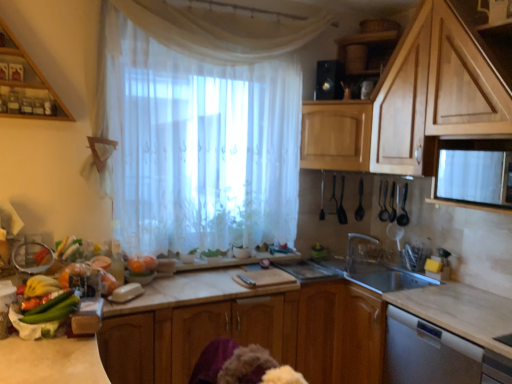
Question: Can you confirm if green matte cucumber at lower left is smaller than black plastic spoon at right, the fifth appliance viewed from the left?

Choices:
 (A) no
 (B) yes

Answer: (B)

Question: Considering the relative positions of green matte cucumber at lower left and black plastic spoon at right, placed as the third appliance when sorted from right to left, in the image provided, is green matte cucumber at lower left to the right of black plastic spoon at right, placed as the third appliance when sorted from right to left, from the viewer's perspective?

Choices:
 (A) no
 (B) yes

Answer: (A)

Question: Is green matte cucumber at lower left far from black plastic spoon at right, placed as the third appliance when sorted from right to left?

Choices:
 (A) no
 (B) yes

Answer: (B)

Question: From a real-world perspective, is green matte cucumber at lower left below black plastic spoon at right, placed as the third appliance when sorted from right to left?

Choices:
 (A) no
 (B) yes

Answer: (B)

Question: From the image's perspective, is green matte cucumber at lower left located beneath black plastic spoon at right, the fifth appliance viewed from the left?

Choices:
 (A) no
 (B) yes

Answer: (B)

Question: Visually, is black plastic spoons at upper right, arranged as the sixth appliance when viewed from the left, positioned to the left or to the right of marble countertop at center?

Choices:
 (A) left
 (B) right

Answer: (B)

Question: From the image's perspective, is black plastic spoons at upper right, marked as the second appliance in a right-to-left arrangement, located above or below marble countertop at center?

Choices:
 (A) below
 (B) above

Answer: (B)

Question: Is point (382, 200) positioned closer to the camera than point (265, 299)?

Choices:
 (A) closer
 (B) farther

Answer: (B)

Question: From a real-world perspective, is black plastic spoons at upper right, arranged as the sixth appliance when viewed from the left, physically located above or below marble countertop at center?

Choices:
 (A) above
 (B) below

Answer: (A)

Question: From a real-world perspective, is green matte cucumber at lower left positioned above or below black plastic speaker at upper center, which is the sixth appliance in right-to-left order?

Choices:
 (A) above
 (B) below

Answer: (B)

Question: From the image's perspective, is green matte cucumber at lower left positioned above or below black plastic speaker at upper center, the 2th appliance from the left?

Choices:
 (A) above
 (B) below

Answer: (B)

Question: Is green matte cucumber at lower left in front of or behind black plastic speaker at upper center, which is the sixth appliance in right-to-left order, in the image?

Choices:
 (A) behind
 (B) front

Answer: (B)

Question: Considering the positions of point (54, 311) and point (330, 61), is point (54, 311) closer or farther from the camera than point (330, 61)?

Choices:
 (A) closer
 (B) farther

Answer: (A)

Question: From the image's perspective, is wooden cabinet at upper left, the 4th cabinetry ordered from the bottom, located above or below marble countertop at center?

Choices:
 (A) below
 (B) above

Answer: (B)

Question: From a real-world perspective, is wooden cabinet at upper left, which is counted as the first cabinetry, starting from the top, positioned above or below marble countertop at center?

Choices:
 (A) above
 (B) below

Answer: (A)